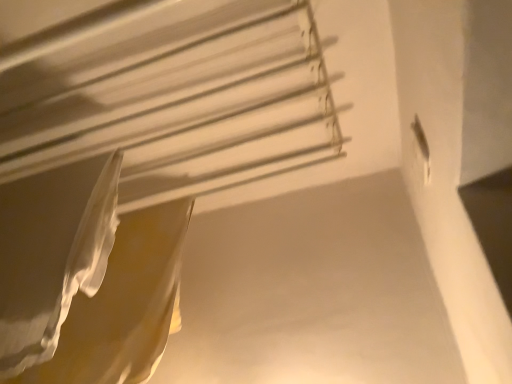
What is the approximate width of white sheer fabric at lower left?

white sheer fabric at lower left is 2.96 inches wide.

The width and height of the screenshot is (512, 384). Describe the element at coordinates (85, 277) in the screenshot. I see `white sheer fabric at lower left` at that location.

The height and width of the screenshot is (384, 512). In order to click on white sheer fabric at lower left in this screenshot , I will do pos(85,277).

Identify the location of white sheer fabric at lower left. This screenshot has height=384, width=512. (85, 277).